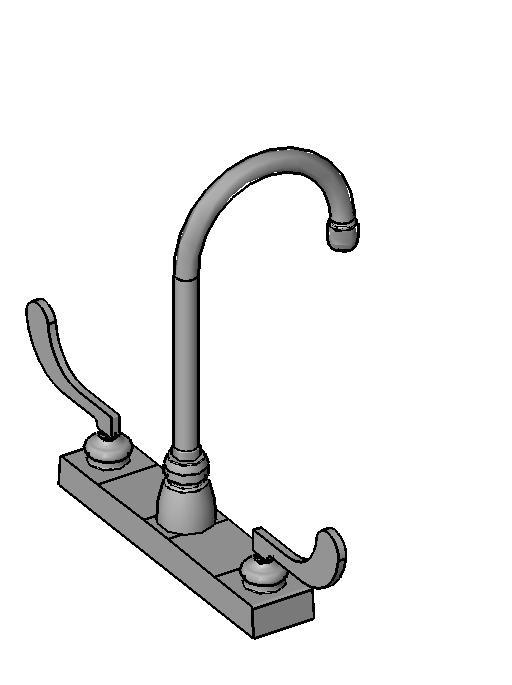
Locate an element on the screen. This screenshot has height=685, width=512. 2 screws for knobs is located at coordinates (269, 570), (117, 462).